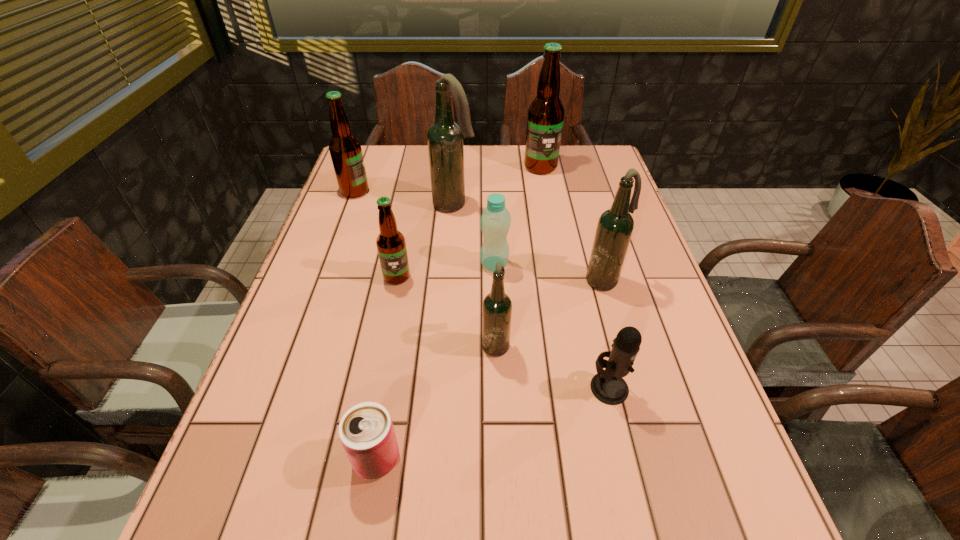
This screenshot has width=960, height=540. I want to click on brown beer bottle object that ranks as the second closest to the second brown beer bottle from right to left, so click(545, 119).

Point out which dark beer bottle is positioned as the nearest to the smallest brown beer bottle. Please provide its 2D coordinates. Your answer should be formatted as a tuple, i.e. [(x, y)], where the tuple contains the x and y coordinates of a point satisfying the conditions above.

[(497, 307)]

Image resolution: width=960 pixels, height=540 pixels. What are the coordinates of `the third closest dark beer bottle relative to the bottle` in the screenshot? It's located at (615, 226).

Where is `free location that satisfies the following two spatial constraints: 1. on the label of the bottle; 2. on the right side of the leftmost beer bottle`? free location that satisfies the following two spatial constraints: 1. on the label of the bottle; 2. on the right side of the leftmost beer bottle is located at coordinates (328, 265).

You are a GUI agent. You are given a task and a screenshot of the screen. Output one action in this format:
    pyautogui.click(x=<x>, y=<y>)
    Task: Click on the free space that satisfies the following two spatial constraints: 1. on the label of the eighth farthest object; 2. on the left side of the second brown beer bottle from right to left
    
    Given the screenshot: What is the action you would take?
    pyautogui.click(x=375, y=388)

This screenshot has height=540, width=960. Find the location of `free space that satisfies the following two spatial constraints: 1. on the back side of the rightmost dark beer bottle; 2. on the left side of the microphone`. free space that satisfies the following two spatial constraints: 1. on the back side of the rightmost dark beer bottle; 2. on the left side of the microphone is located at coordinates (584, 280).

Find the location of a particular element. Image resolution: width=960 pixels, height=540 pixels. vacant space that satisfies the following two spatial constraints: 1. on the back side of the pink can; 2. on the label of the second smallest brown beer bottle is located at coordinates (422, 192).

The width and height of the screenshot is (960, 540). In order to click on vacant space that satisfies the following two spatial constraints: 1. on the label of the farthest brown beer bottle; 2. on the right side of the eighth farthest object in this screenshot , I will do `click(583, 388)`.